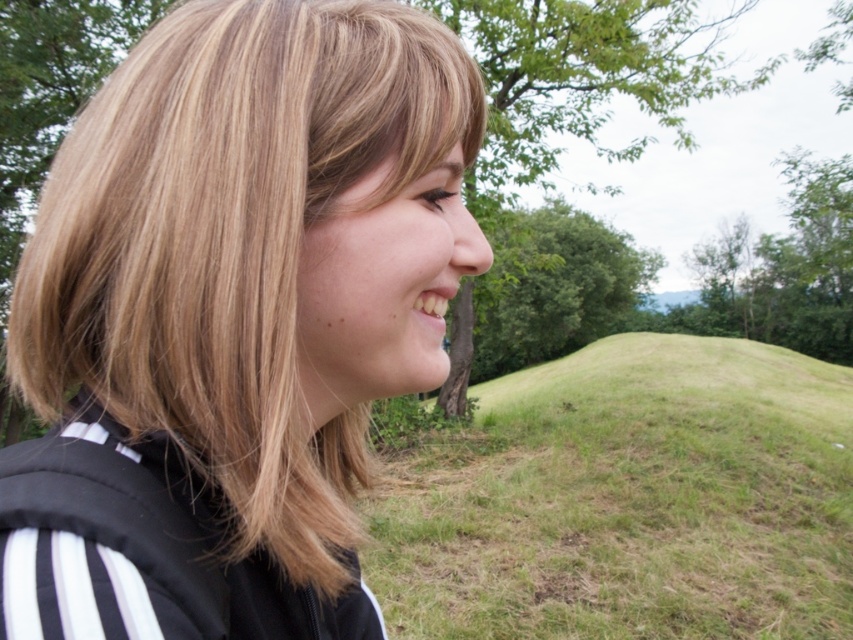
Question: Among these objects, which one is farthest from the camera?

Choices:
 (A) green grassy hill at center
 (B) blonde hair at center

Answer: (A)

Question: Does blonde hair at center appear on the right side of green grassy hill at center?

Choices:
 (A) no
 (B) yes

Answer: (A)

Question: Which point appears closest to the camera in this image?

Choices:
 (A) (502, 538)
 (B) (329, 552)

Answer: (B)

Question: Which object appears closest to the camera in this image?

Choices:
 (A) blonde hair at center
 (B) green grassy hill at center

Answer: (A)

Question: Considering the relative positions of blonde hair at center and green grassy hill at center in the image provided, where is blonde hair at center located with respect to green grassy hill at center?

Choices:
 (A) left
 (B) right

Answer: (A)

Question: Is blonde hair at center below green grassy hill at center?

Choices:
 (A) no
 (B) yes

Answer: (A)